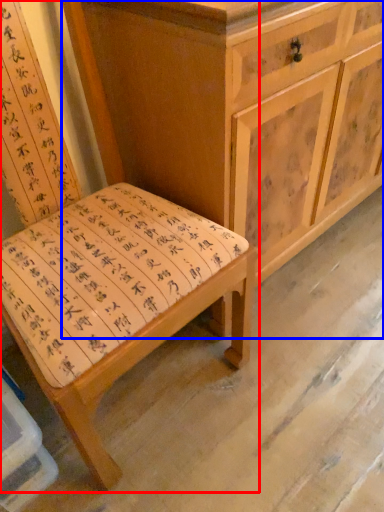
Question: Which of the following is the closest to the observer, chair (highlighted by a red box) or chest of drawers (highlighted by a blue box)?

Choices:
 (A) chair
 (B) chest of drawers

Answer: (A)